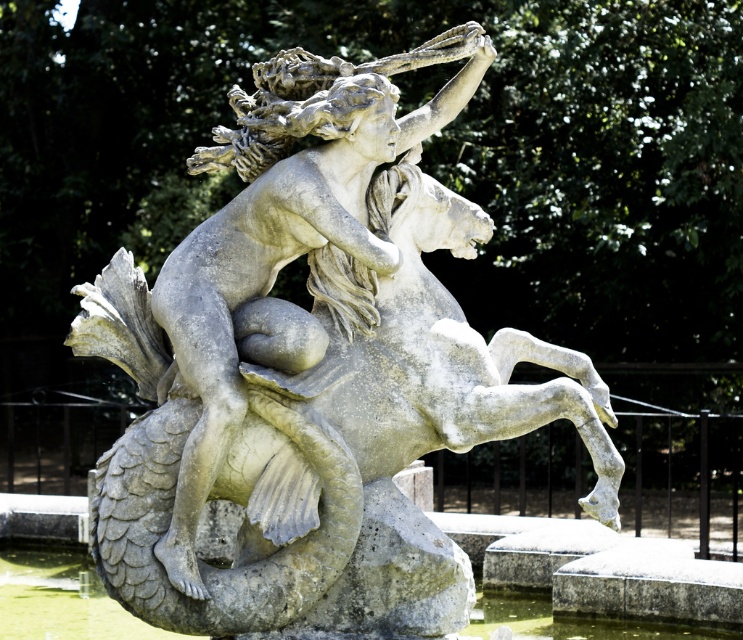
Which is in front, point (399, 68) or point (88, 564)?

Point (399, 68)

Between gray stone sculpture at center and greenish stone water at lower center, which one appears on the right side from the viewer's perspective?

gray stone sculpture at center

Is point (441, 120) farther from camera compared to point (476, 602)?

No, it is not.

What are the coordinates of `gray stone sculpture at center` in the screenshot? It's located at (317, 369).